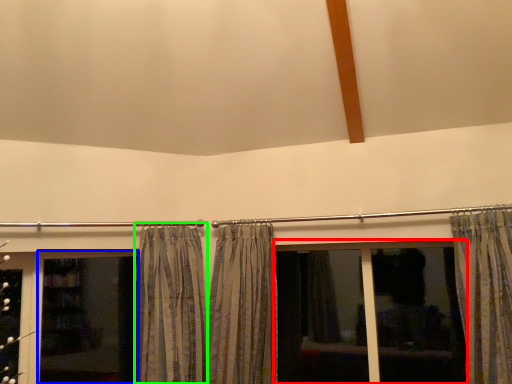
Question: Based on their relative distances, which object is nearer to bay window (highlighted by a red box)? Choose from screen door (highlighted by a blue box) and curtain (highlighted by a green box).

Choices:
 (A) screen door
 (B) curtain

Answer: (B)